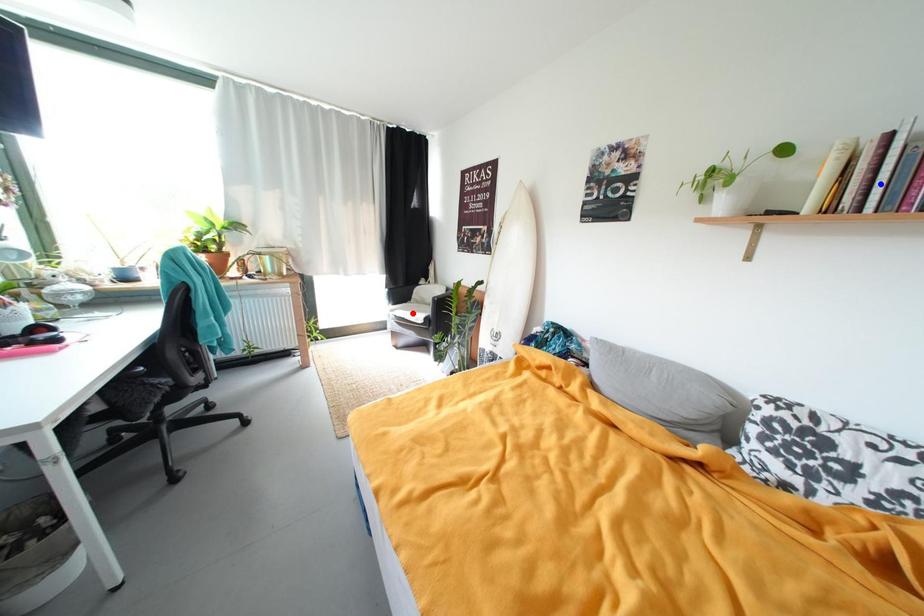
Question: Two points are marked on the image. Which point is closer to the camera?

Choices:
 (A) Blue point is closer.
 (B) Red point is closer.

Answer: (A)